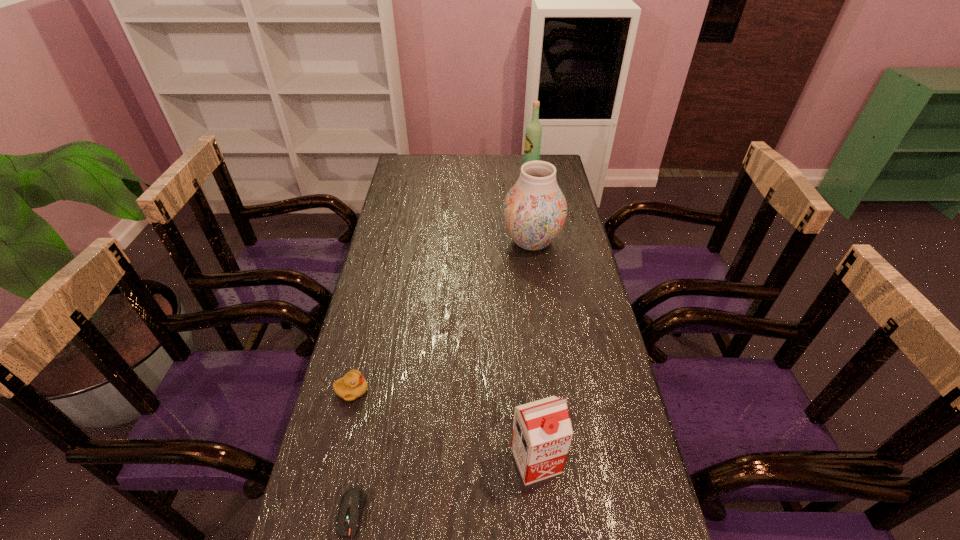
This screenshot has height=540, width=960. I want to click on vacant area between the fourth nearest object and the duckling, so pos(442,316).

This screenshot has height=540, width=960. Find the location of `unoccupied area between the farthest object and the third shortest object`. unoccupied area between the farthest object and the third shortest object is located at coordinates (533, 316).

This screenshot has height=540, width=960. What are the coordinates of `free space that is in between the second farthest object and the soya milk` in the screenshot? It's located at (534, 351).

Where is `empty space between the fourth nearest object and the shortest object`? This screenshot has width=960, height=540. empty space between the fourth nearest object and the shortest object is located at coordinates (442, 377).

Image resolution: width=960 pixels, height=540 pixels. Find the location of `object identified as the second closest to the second farthest object`. object identified as the second closest to the second farthest object is located at coordinates (353, 385).

Identify which object is the fourth closest to the fourth tallest object. Please provide its 2D coordinates. Your answer should be formatted as a tuple, i.e. [(x, y)], where the tuple contains the x and y coordinates of a point satisfying the conditions above.

[(533, 135)]

The height and width of the screenshot is (540, 960). What are the coordinates of `free space in the image that satisfies the following two spatial constraints: 1. at the beak of the third farthest object; 2. on the right side of the soya milk` in the screenshot? It's located at (335, 461).

At what (x,y) coordinates should I click in order to perform the action: click on vacant space that satisfies the following two spatial constraints: 1. at the beak of the fourth tallest object; 2. on the left side of the soya milk. Please return your answer as a coordinate pair (x, y). The height and width of the screenshot is (540, 960). Looking at the image, I should click on (335, 461).

Identify the location of vacant space that satisfies the following two spatial constraints: 1. on the back side of the soya milk; 2. at the beak of the third nearest object. (529, 390).